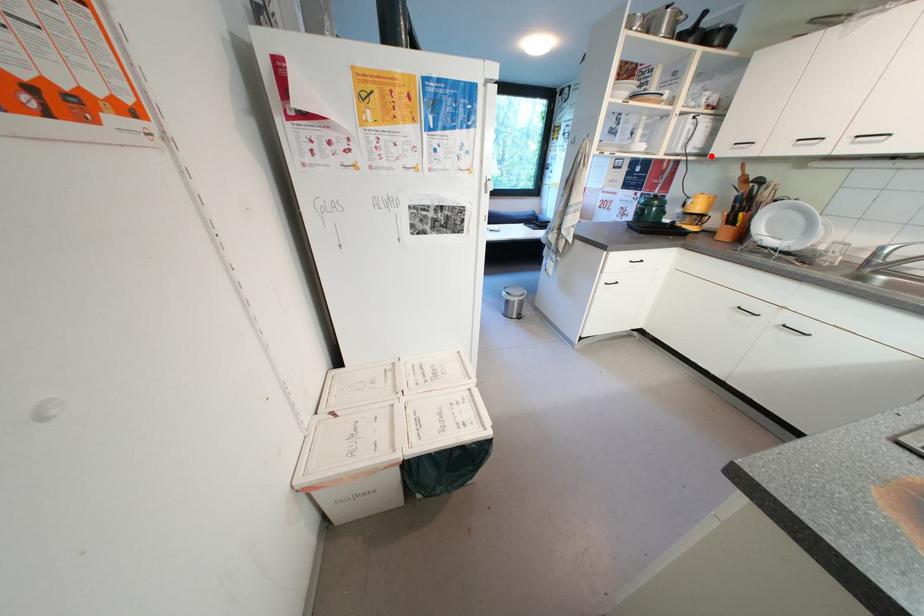
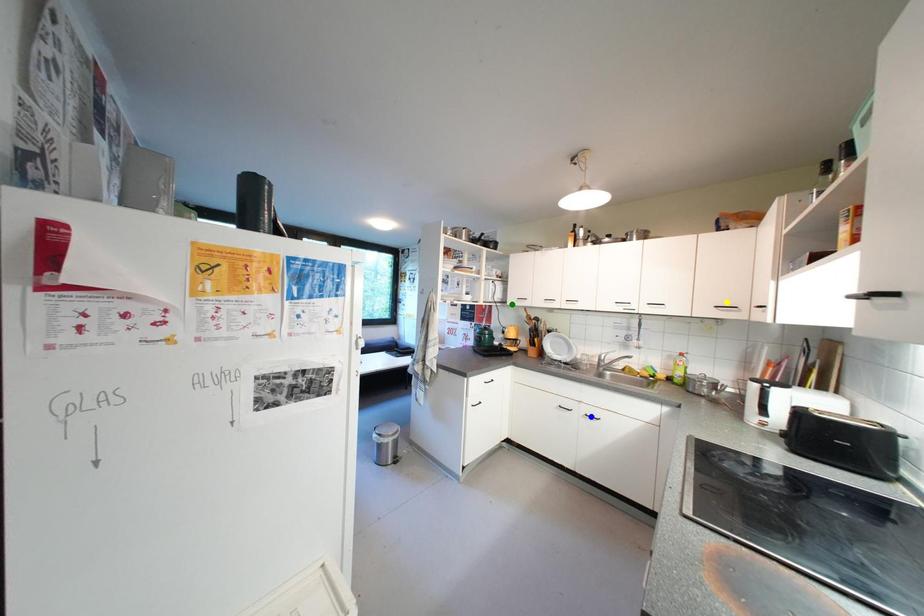
Question: I am providing you with two images of the same scene from different viewpoints. A red point is marked on the first image. You are given multiple points on the second image. Which mark in image 2 goes with the point in image 1?

Choices:
 (A) blue point
 (B) green point
 (C) yellow point

Answer: (B)